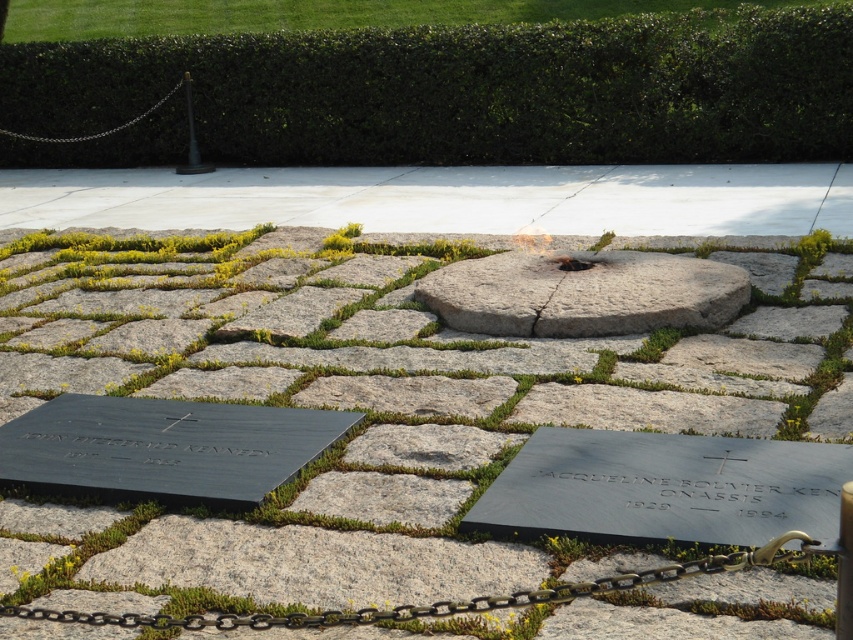
You are a visitor at the memorial site and want to take a photo of the black granite stone at center and the silver metallic chain at upper left. Which object should you focus on first if you want to capture both in a single frame without moving the camera?

The black granite stone at center is bigger than the silver metallic chain at upper left, so you should focus on the black granite stone at center first to ensure it is properly framed before adjusting for the smaller silver metallic chain at upper left.

You are standing at the memorial site and want to place a wreath at the exact center of the gray granite stone marked by point (583, 292). How should you position the wreath relative to the central circular stone structure with the flame?

The point (583, 292) marks the gray granite stone at center, so you should place the wreath exactly at the center of the gray granite stone where the point is located, directly over the central circular stone structure with the flame.